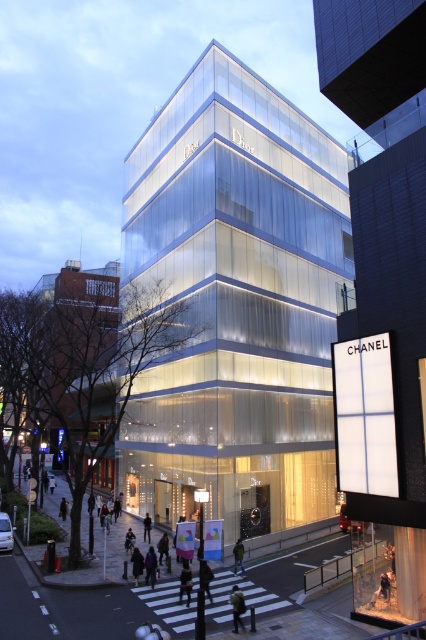
Is dark blue jacket at lower center thinner than green fabric jacket at lower center?

No.

Who is more forward, (137, 582) or (238, 540)?

Point (137, 582) is more forward.

Which is behind, point (132, 557) or point (241, 544)?

The point (241, 544) is behind.

Locate an element on the screen. dark blue jacket at lower center is located at coordinates (137, 563).

Does dark brown leather backpack at lower center have a smaller size compared to dark purple coat at center?

Yes, dark brown leather backpack at lower center is smaller than dark purple coat at center.

Is dark brown leather backpack at lower center further to camera compared to dark purple coat at center?

No, dark brown leather backpack at lower center is closer to the viewer.

The height and width of the screenshot is (640, 426). Describe the element at coordinates (236, 605) in the screenshot. I see `dark brown leather backpack at lower center` at that location.

Image resolution: width=426 pixels, height=640 pixels. I want to click on dark brown leather backpack at lower center, so click(x=236, y=605).

Is transparent glass building at center bigger than dark gray fabric at lower center?

Indeed, transparent glass building at center has a larger size compared to dark gray fabric at lower center.

Who is shorter, transparent glass building at center or dark gray fabric at lower center?

dark gray fabric at lower center is shorter.

Does point (158, 236) lie behind point (184, 570)?

Yes, it is behind point (184, 570).

Image resolution: width=426 pixels, height=640 pixels. What are the coordinates of `transparent glass building at center` in the screenshot? It's located at (236, 304).